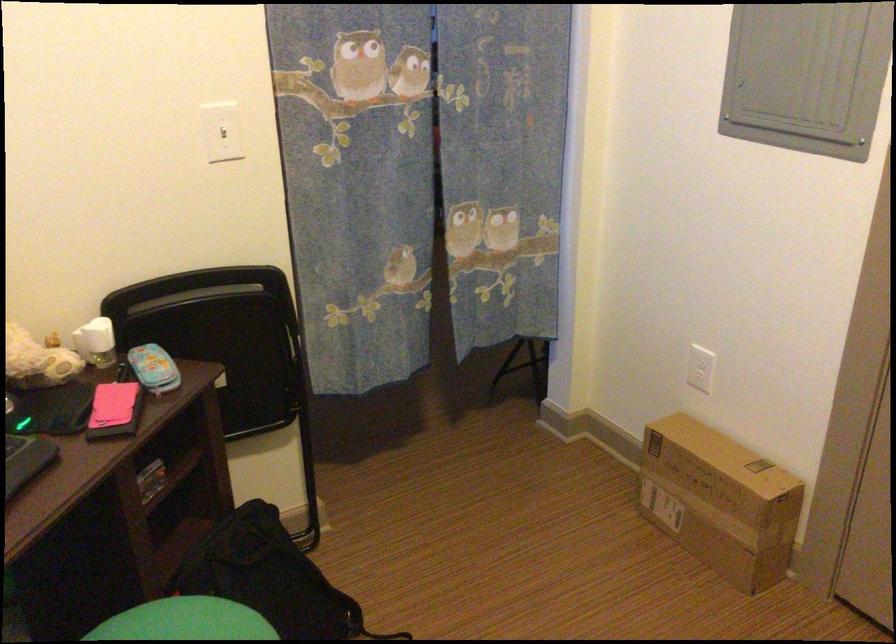
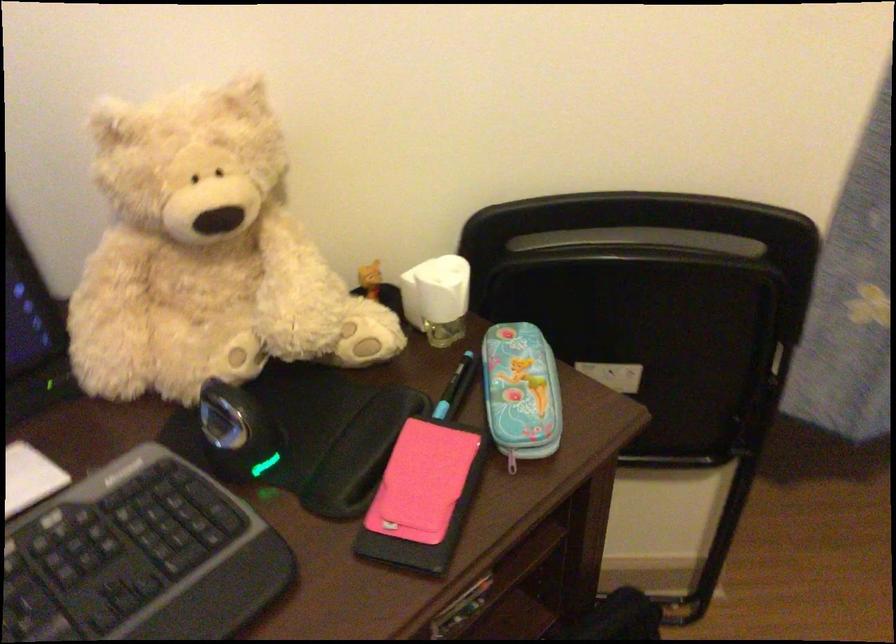
The point at (108,404) is marked in the first image. Where is the corresponding point in the second image?

(421, 482)